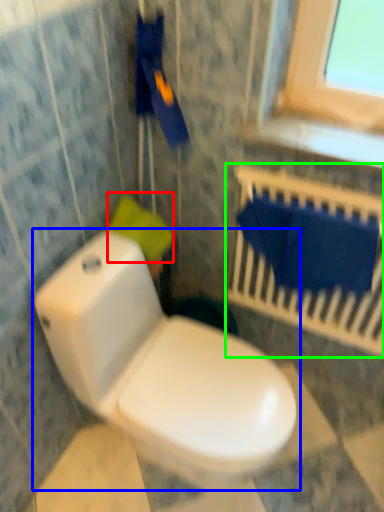
Question: Which is nearer to the toilet paper (highlighted by a red box)? toilet (highlighted by a blue box) or balustrade (highlighted by a green box).

Choices:
 (A) toilet
 (B) balustrade

Answer: (A)